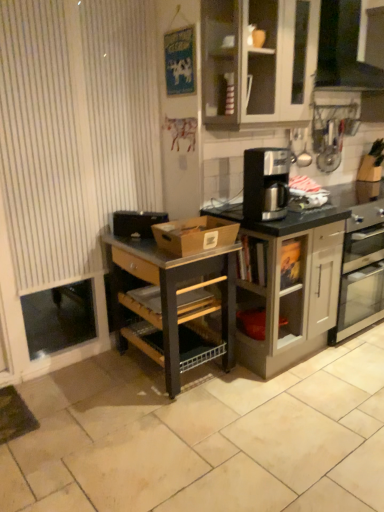
At what (x,y) coordinates should I click in order to perform the action: click on free space that is to the left of metallic black shelf at center. Please return your answer as a coordinate pair (x, y). Looking at the image, I should click on (84, 384).